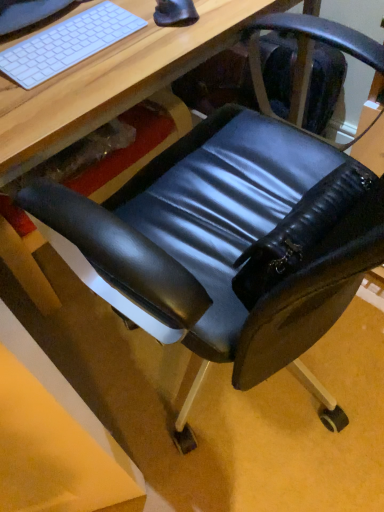
Locate an element on the screen. Image resolution: width=384 pixels, height=512 pixels. free point above white matte keyboard at upper left (from a real-world perspective) is located at coordinates (65, 35).